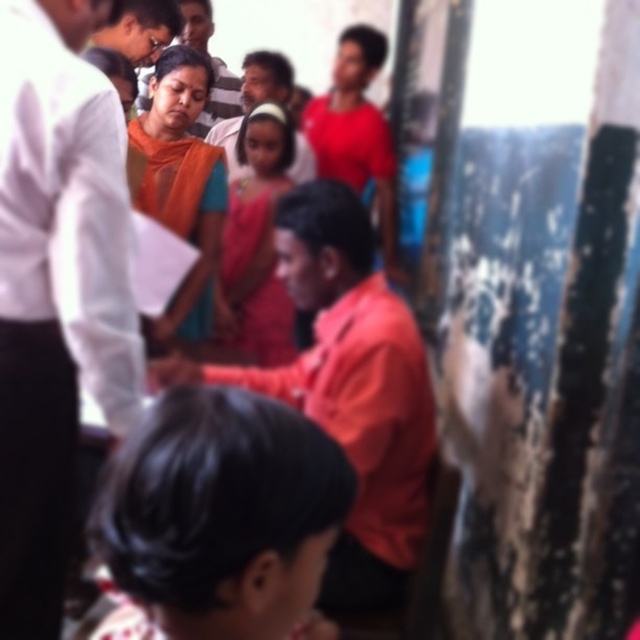
Does orange matte shirt at center have a greater height compared to matte orange saree at upper center?

No.

In order to click on orange matte shirt at center in this screenshot , I will do `click(349, 388)`.

Is point (70, 109) less distant than point (256, 326)?

Yes, it is.

Is point (10, 340) positioned after point (240, 316)?

No, it is not.

The width and height of the screenshot is (640, 640). Identify the location of matte white shirt at center. (54, 289).

Which is more to the left, pink satin dress at center or matte orange saree at upper center?

pink satin dress at center

How much distance is there between pink satin dress at center and matte orange saree at upper center?

pink satin dress at center and matte orange saree at upper center are 1.02 meters apart.

The width and height of the screenshot is (640, 640). Find the location of `pink satin dress at center`. pink satin dress at center is located at coordinates (256, 243).